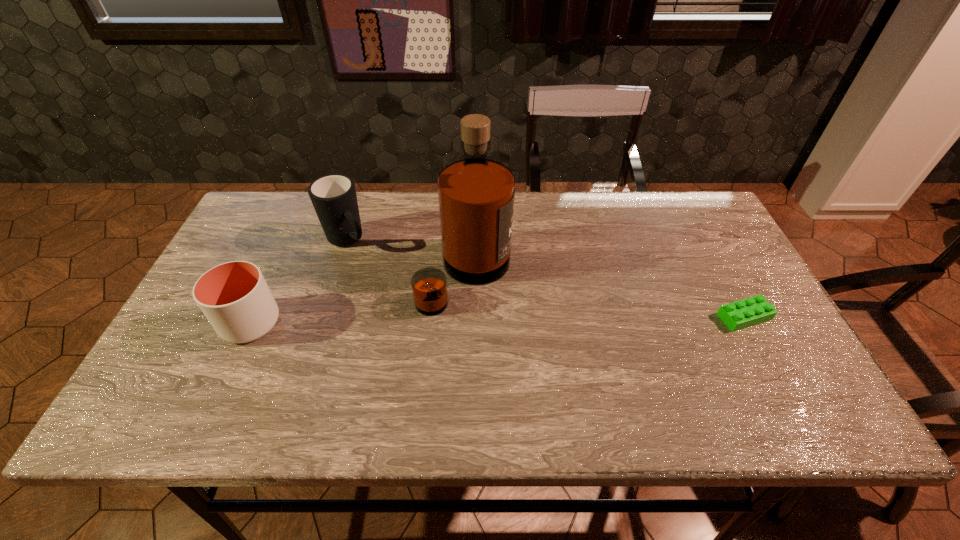
At what (x,y) coordinates should I click in order to perform the action: click on blank space at the far edge of the desktop. Please return your answer as a coordinate pair (x, y). This screenshot has width=960, height=540. Looking at the image, I should click on (405, 193).

Image resolution: width=960 pixels, height=540 pixels. In the image, there is a desktop. Identify the location of vacant space at the near edge. (288, 362).

This screenshot has height=540, width=960. In order to click on free space at the right edge of the desktop in this screenshot , I will do `click(740, 298)`.

Find the location of a particular element. free space at the far left corner of the desktop is located at coordinates (268, 196).

Find the location of a particular element. blank area at the near left corner is located at coordinates (167, 366).

In the image, there is a desktop. Identify the location of vacant space at the far right corner. Image resolution: width=960 pixels, height=540 pixels. (x=683, y=223).

What are the coordinates of `blank region between the mug and the cup` in the screenshot? It's located at (299, 281).

Find the location of a particular element. The image size is (960, 540). unoccupied area between the leftmost object and the second object from right to left is located at coordinates (358, 299).

This screenshot has width=960, height=540. Identify the location of empty space that is in between the second object from right to left and the second shortest object. (358, 299).

In order to click on free space between the third object from left to right and the leftmost object in this screenshot , I will do `click(358, 299)`.